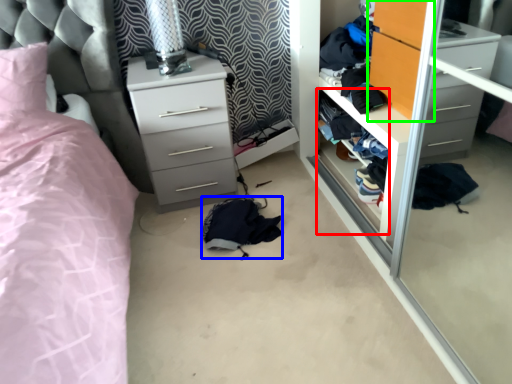
Question: Which is nearer to the shelf (highlighted by a red box)? clothing (highlighted by a blue box) or armoire (highlighted by a green box).

Choices:
 (A) clothing
 (B) armoire

Answer: (B)